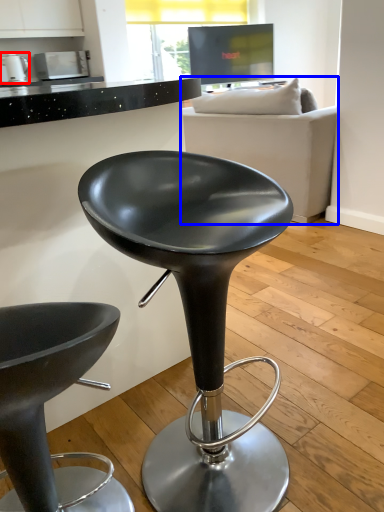
Question: Among these objects, which one is farthest to the camera, appliance (highlighted by a red box) or studio couch (highlighted by a blue box)?

Choices:
 (A) appliance
 (B) studio couch

Answer: (A)